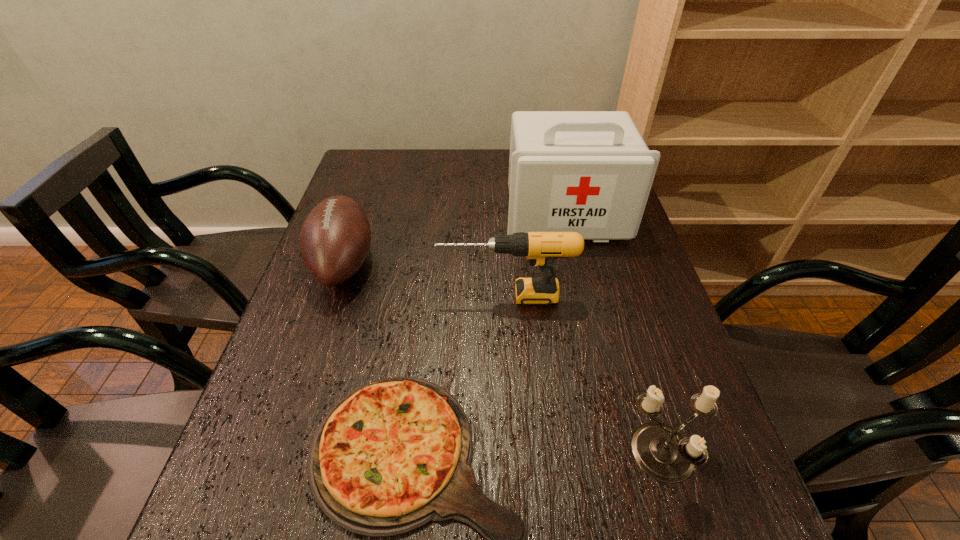
You are a GUI agent. You are given a task and a screenshot of the screen. Output one action in this format:
    pyautogui.click(x=<x>, y=<y>)
    Task: Click on the tallest object
    This screenshot has width=960, height=540.
    Given the screenshot: What is the action you would take?
    pyautogui.click(x=590, y=172)

Identify the location of drill. (541, 248).

Identify the location of football (American). (335, 239).

Image resolution: width=960 pixels, height=540 pixels. What are the coordinates of `candle holder` in the screenshot? It's located at point(665,454).

Locate an element on the screen. vacant space situated 0.300m on the front-facing side of the tallest object is located at coordinates (594, 334).

Locate an element on the screen. Image resolution: width=960 pixels, height=540 pixels. free space located on the handle side of the drill is located at coordinates (320, 296).

Where is `free location located on the handle side of the drill`? The image size is (960, 540). free location located on the handle side of the drill is located at coordinates (298, 296).

Locate an element on the screen. This screenshot has height=540, width=960. free location located on the handle side of the drill is located at coordinates (345, 296).

I want to click on free region located on the back of the football (American), so click(x=377, y=160).

What are the coordinates of `vacant region located on the back of the candle holder` in the screenshot? It's located at (625, 328).